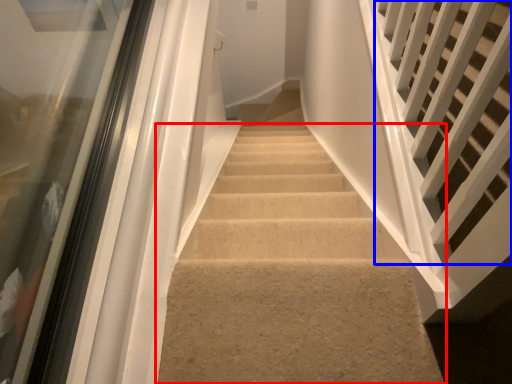
Question: Among these objects, which one is farthest to the camera, stairs (highlighted by a red box) or stairs (highlighted by a blue box)?

Choices:
 (A) stairs
 (B) stairs

Answer: (A)